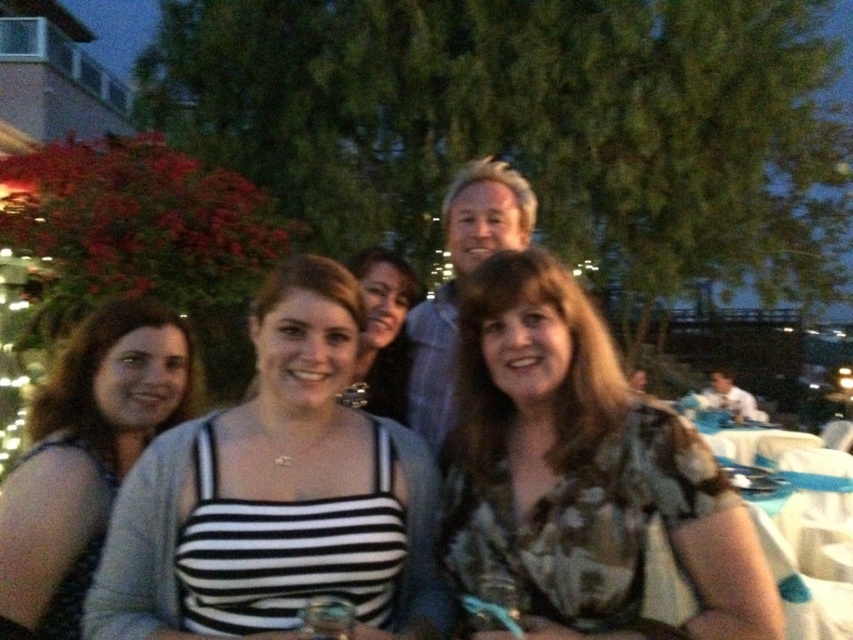
Question: Considering the relative positions of camouflage-patterned blouse at center and matte black tank top at left in the image provided, where is camouflage-patterned blouse at center located with respect to matte black tank top at left?

Choices:
 (A) left
 (B) right

Answer: (B)

Question: Which object is closer to the camera taking this photo?

Choices:
 (A) matte black tank top at center
 (B) matte black tank top at left

Answer: (B)

Question: Does matte black tank top at left appear on the right side of matte black tank top at center?

Choices:
 (A) yes
 (B) no

Answer: (B)

Question: Where is black striped tank top at center located in relation to matte black tank top at center in the image?

Choices:
 (A) left
 (B) right

Answer: (A)

Question: Which of these objects is positioned closest to the camouflage-patterned blouse at center?

Choices:
 (A) matte black tank top at left
 (B) black striped tank top at center

Answer: (B)

Question: Which point is farther to the camera?

Choices:
 (A) (496, 260)
 (B) (399, 541)

Answer: (A)